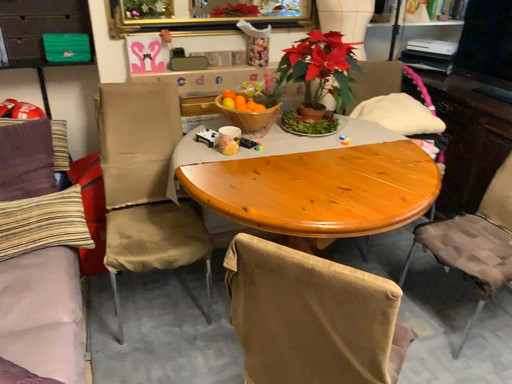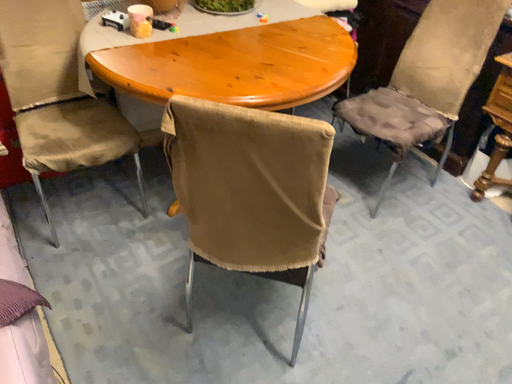
Question: Which way did the camera rotate in the video?

Choices:
 (A) rotated left
 (B) rotated right

Answer: (B)